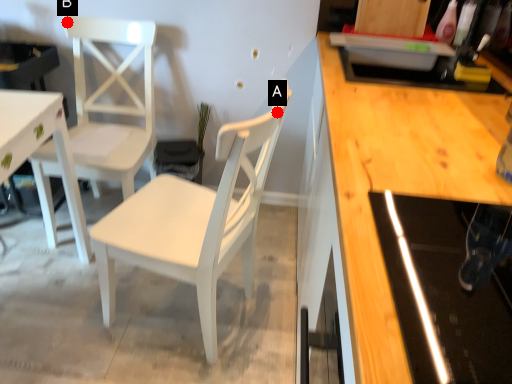
Question: Two points are circled on the image, labeled by A and B beside each circle. Which of the following is the farthest from the observer?

Choices:
 (A) A is further
 (B) B is further

Answer: (B)